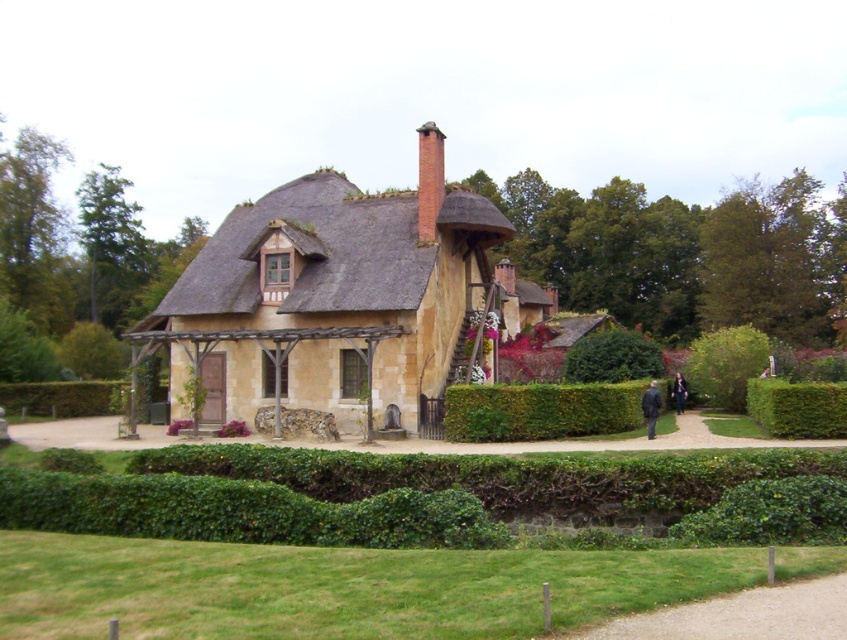
Question: Which object is positioned closest to the green leafy hedge at lower right?

Choices:
 (A) beige stone cottage at center
 (B) green leafy bush at lower left

Answer: (A)

Question: Is dark blue fabric coat at lower right above dark brown hair at center?

Choices:
 (A) yes
 (B) no

Answer: (A)

Question: Which is nearer to the green leafy bush at right?

Choices:
 (A) green leafy hedge at lower right
 (B) dark blue fabric coat at lower right
 (C) green leafy hedge at center

Answer: (B)

Question: Which of these objects is positioned closest to the green leafy bush at right?

Choices:
 (A) green leafy bush at lower left
 (B) green leafy hedge at lower right
 (C) green leafy bush at center

Answer: (C)

Question: Where is green leafy hedge at center located in relation to brick chimney at upper center in the image?

Choices:
 (A) right
 (B) left

Answer: (A)

Question: Is green leafy bush at right below brick chimney at upper center?

Choices:
 (A) no
 (B) yes

Answer: (B)